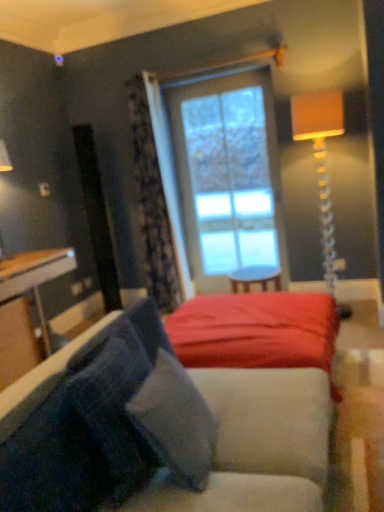
Question: Considering the relative sizes of clear glass window at center and smooth red fabric bed at center in the image provided, is clear glass window at center bigger than smooth red fabric bed at center?

Choices:
 (A) yes
 (B) no

Answer: (B)

Question: Is clear glass window at center beside smooth red fabric bed at center?

Choices:
 (A) yes
 (B) no

Answer: (B)

Question: Is clear glass window at center not inside smooth red fabric bed at center?

Choices:
 (A) no
 (B) yes

Answer: (B)

Question: Are clear glass window at center and smooth red fabric bed at center far apart?

Choices:
 (A) no
 (B) yes

Answer: (B)

Question: From the image's perspective, is clear glass window at center on top of smooth red fabric bed at center?

Choices:
 (A) no
 (B) yes

Answer: (B)

Question: Can you confirm if clear glass window at center is positioned to the right of smooth red fabric bed at center?

Choices:
 (A) yes
 (B) no

Answer: (A)

Question: Would you say orange fabric lampshade at upper right is a long distance from velvety gray pillow at lower left, which is the second pillow from left to right?

Choices:
 (A) yes
 (B) no

Answer: (A)

Question: Considering the relative sizes of orange fabric lampshade at upper right and velvety gray pillow at lower left, the first pillow when ordered from right to left, in the image provided, is orange fabric lampshade at upper right smaller than velvety gray pillow at lower left, the first pillow when ordered from right to left,?

Choices:
 (A) yes
 (B) no

Answer: (B)

Question: Considering the relative sizes of orange fabric lampshade at upper right and velvety gray pillow at lower left, which is the second pillow from left to right, in the image provided, is orange fabric lampshade at upper right thinner than velvety gray pillow at lower left, which is the second pillow from left to right,?

Choices:
 (A) yes
 (B) no

Answer: (B)

Question: Is orange fabric lampshade at upper right to the right of velvety gray pillow at lower left, the first pillow when ordered from right to left, from the viewer's perspective?

Choices:
 (A) no
 (B) yes

Answer: (B)

Question: Is orange fabric lampshade at upper right wider than velvety gray pillow at lower left, which is the second pillow from left to right?

Choices:
 (A) yes
 (B) no

Answer: (A)

Question: Does orange fabric lampshade at upper right lie behind velvety gray pillow at lower left, the first pillow when ordered from right to left?

Choices:
 (A) no
 (B) yes

Answer: (B)

Question: Does velvety gray pillow at lower left, which is the second pillow from left to right, touch velvety blue pillow at lower left, which ranks as the 2th pillow in right-to-left order?

Choices:
 (A) no
 (B) yes

Answer: (A)